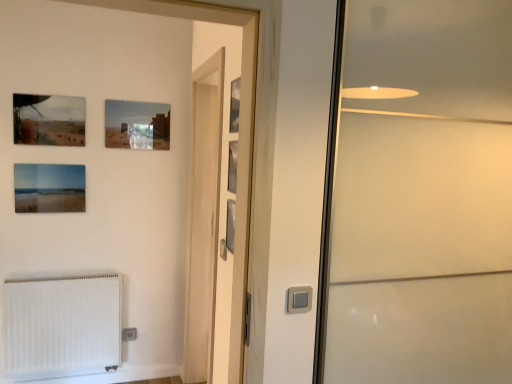
In order to face matte glass picture frame at upper center, which ranks as the first picture frame in back-to-front order, should I rotate leftwards or rightwards?

Turn left by 15.341 degrees to look at matte glass picture frame at upper center, which ranks as the first picture frame in back-to-front order.

What do you see at coordinates (49, 120) in the screenshot?
I see `matte glass picture frame at upper left, acting as the fourth picture frame starting from the front` at bounding box center [49, 120].

Describe the element at coordinates (234, 105) in the screenshot. I see `metallic silver picture frame at upper center, which is the 6th picture frame from back to front` at that location.

Find the location of a particular element. This screenshot has height=384, width=512. transparent glass screen door at right, the 2th screen door viewed from the left is located at coordinates (418, 195).

This screenshot has height=384, width=512. Describe the element at coordinates (203, 219) in the screenshot. I see `wooden screen door at center, marked as the 1th screen door in a left-to-right arrangement` at that location.

What is the approximate height of white matte radiator at lower left?

It is 25.38 inches.

You are a GUI agent. You are given a task and a screenshot of the screen. Output one action in this format:
    pyautogui.click(x=<x>, y=<y>)
    Task: Click on the matte glass picture frame at upper center, which ranks as the first picture frame in back-to-front order
    This screenshot has height=384, width=512.
    Given the screenshot: What is the action you would take?
    pyautogui.click(x=137, y=125)

Is matte glass picture frame at upper left, positioned as the 3th picture frame in back-to-front order, turned away from matte glass picture frame at upper center, which is the third picture frame in left-to-right order?

No, matte glass picture frame at upper left, positioned as the 3th picture frame in back-to-front order,'s orientation is not away from matte glass picture frame at upper center, which is the third picture frame in left-to-right order.

From the matte glass picture frame at upper left, positioned as the 3th picture frame in back-to-front order, count 1st picture frame to the right and point to it. Please provide its 2D coordinates.

[(137, 125)]

Between matte glass picture frame at upper left, positioned as the 3th picture frame in back-to-front order, and matte glass picture frame at upper center, which is the 4th picture frame in right-to-left order, which one is positioned in front?

Positioned in front is matte glass picture frame at upper left, positioned as the 3th picture frame in back-to-front order.

Is white plastic electric outlet at lower left further to the viewer compared to metallic silver picture frame at upper center, acting as the first picture frame starting from the front?

Yes, it is behind metallic silver picture frame at upper center, acting as the first picture frame starting from the front.

Based on the photo, does white plastic electric outlet at lower left have a larger size compared to metallic silver picture frame at upper center, which is the 1th picture frame from right to left?

No, white plastic electric outlet at lower left is not bigger than metallic silver picture frame at upper center, which is the 1th picture frame from right to left.

Looking at this image, considering the relative positions of white plastic electric outlet at lower left and metallic silver picture frame at upper center, acting as the first picture frame starting from the front, in the image provided, is white plastic electric outlet at lower left to the right of metallic silver picture frame at upper center, acting as the first picture frame starting from the front, from the viewer's perspective?

No.

Is point (123, 330) behind point (232, 97)?

Yes.

Could you measure the distance between white plastic electric outlet at lower left and wooden screen door at center, the 2th screen door viewed from the right?

white plastic electric outlet at lower left is 1.01 meters away from wooden screen door at center, the 2th screen door viewed from the right.

Would you consider white plastic electric outlet at lower left to be distant from wooden screen door at center, the 2th screen door viewed from the right?

Yes, white plastic electric outlet at lower left and wooden screen door at center, the 2th screen door viewed from the right, are located far from each other.

Can you confirm if white plastic electric outlet at lower left is smaller than wooden screen door at center, the 2th screen door viewed from the right?

Yes, white plastic electric outlet at lower left is smaller than wooden screen door at center, the 2th screen door viewed from the right.

Can we say white plastic electric outlet at lower left lies outside wooden screen door at center, marked as the 1th screen door in a left-to-right arrangement?

white plastic electric outlet at lower left lies outside wooden screen door at center, marked as the 1th screen door in a left-to-right arrangement,'s area.

Between metallic silver picture frame at center, which appears as the third picture frame when viewed from the right, and metallic silver picture frame at upper center, which is counted as the 5th picture frame, starting from the left, which one has more height?

Standing taller between the two is metallic silver picture frame at upper center, which is counted as the 5th picture frame, starting from the left.

Is metallic silver picture frame at center, which appears as the third picture frame when viewed from the front, completely or partially outside of metallic silver picture frame at upper center, the fifth picture frame from the back?

Yes, metallic silver picture frame at center, which appears as the third picture frame when viewed from the front, is not within metallic silver picture frame at upper center, the fifth picture frame from the back.

Consider the image. From a real-world perspective, is metallic silver picture frame at center, which appears as the third picture frame when viewed from the right, on top of metallic silver picture frame at upper center, which is counted as the 5th picture frame, starting from the left?

No.

From a real-world perspective, is white plastic electric outlet at lower left positioned above or below metallic silver picture frame at upper center, which is counted as the 5th picture frame, starting from the left?

From a real-world perspective, white plastic electric outlet at lower left is physically below metallic silver picture frame at upper center, which is counted as the 5th picture frame, starting from the left.

Based on the photo, is white plastic electric outlet at lower left oriented towards metallic silver picture frame at upper center, the fifth picture frame from the back?

No, white plastic electric outlet at lower left is not facing towards metallic silver picture frame at upper center, the fifth picture frame from the back.

Which object is thinner, white plastic electric outlet at lower left or metallic silver picture frame at upper center, which is counted as the 5th picture frame, starting from the left?

With smaller width is metallic silver picture frame at upper center, which is counted as the 5th picture frame, starting from the left.

Considering the relative sizes of white plastic electric outlet at lower left and metallic silver picture frame at upper center, positioned as the 2th picture frame in right-to-left order, in the image provided, is white plastic electric outlet at lower left bigger than metallic silver picture frame at upper center, positioned as the 2th picture frame in right-to-left order,?

No, white plastic electric outlet at lower left is not bigger than metallic silver picture frame at upper center, positioned as the 2th picture frame in right-to-left order.

In the scene shown: From the image's perspective, which object appears higher, white plastic electric outlet at lower left or matte glass picture frame at upper center, the sixth picture frame from the front?

matte glass picture frame at upper center, the sixth picture frame from the front, appears higher in the image.

In the scene shown: Considering the relative sizes of white plastic electric outlet at lower left and matte glass picture frame at upper center, which is the third picture frame in left-to-right order, in the image provided, is white plastic electric outlet at lower left bigger than matte glass picture frame at upper center, which is the third picture frame in left-to-right order,?

Incorrect, white plastic electric outlet at lower left is not larger than matte glass picture frame at upper center, which is the third picture frame in left-to-right order.

Is white plastic electric outlet at lower left at the left side of matte glass picture frame at upper center, which is the third picture frame in left-to-right order?

Yes.

Would you consider white plastic electric outlet at lower left to be distant from matte glass picture frame at upper center, the sixth picture frame from the front?

white plastic electric outlet at lower left is far away from matte glass picture frame at upper center, the sixth picture frame from the front.

Looking at this image, which of these two, metallic silver picture frame at upper center, the 2th picture frame positioned from the front, or metallic silver picture frame at center, which appears as the third picture frame when viewed from the front, stands shorter?

Standing shorter between the two is metallic silver picture frame at center, which appears as the third picture frame when viewed from the front.

Considering the sizes of objects metallic silver picture frame at upper center, the fifth picture frame from the back, and metallic silver picture frame at center, acting as the fourth picture frame starting from the left, in the image provided, who is bigger, metallic silver picture frame at upper center, the fifth picture frame from the back, or metallic silver picture frame at center, acting as the fourth picture frame starting from the left,?

With larger size is metallic silver picture frame at upper center, the fifth picture frame from the back.

Is metallic silver picture frame at upper center, the 2th picture frame positioned from the front, inside or outside of metallic silver picture frame at center, acting as the 4th picture frame starting from the back?

metallic silver picture frame at upper center, the 2th picture frame positioned from the front, is outside metallic silver picture frame at center, acting as the 4th picture frame starting from the back.

Is metallic silver picture frame at upper center, the 2th picture frame positioned from the front, in front of metallic silver picture frame at center, acting as the fourth picture frame starting from the left?

Yes, the depth of metallic silver picture frame at upper center, the 2th picture frame positioned from the front, is less than that of metallic silver picture frame at center, acting as the fourth picture frame starting from the left.

You are a GUI agent. You are given a task and a screenshot of the screen. Output one action in this format:
    pyautogui.click(x=<x>, y=<y>)
    Task: Click on the 1st picture frame to the left when counting from the matte glass picture frame at upper center, which ranks as the first picture frame in back-to-front order
    The image size is (512, 384).
    Given the screenshot: What is the action you would take?
    pyautogui.click(x=49, y=120)

Which picture frame is the 6th one when counting from the front of the white plastic electric outlet at lower left? Please provide its 2D coordinates.

[(234, 105)]

In the scene shown: From the image, which object appears to be farther from metallic silver picture frame at upper center, which is the 1th picture frame from right to left, matte glass picture frame at upper center, which is the 4th picture frame in right-to-left order, or transparent glass screen door at right, which appears as the first screen door when viewed from the right?

The object further to metallic silver picture frame at upper center, which is the 1th picture frame from right to left, is matte glass picture frame at upper center, which is the 4th picture frame in right-to-left order.

When comparing their distances from white matte radiator at lower left, does matte glass picture frame at upper center, the sixth picture frame from the front, or wooden screen door at center, marked as the 1th screen door in a left-to-right arrangement, seem closer?

wooden screen door at center, marked as the 1th screen door in a left-to-right arrangement.

Which object lies further to the anchor point matte glass picture frame at upper left, acting as the fourth picture frame starting from the front, white matte radiator at lower left or transparent glass screen door at right, which appears as the first screen door when viewed from the right?

Among the two, transparent glass screen door at right, which appears as the first screen door when viewed from the right, is located further to matte glass picture frame at upper left, acting as the fourth picture frame starting from the front.

When comparing their distances from matte glass picture frame at upper left, which ranks as the 5th picture frame in right-to-left order, does metallic silver picture frame at upper center, the 6th picture frame when ordered from left to right, or matte glass picture frame at upper center, which is the third picture frame in left-to-right order, seem further?

metallic silver picture frame at upper center, the 6th picture frame when ordered from left to right, lies further to matte glass picture frame at upper left, which ranks as the 5th picture frame in right-to-left order, than the other object.

When comparing their distances from wooden screen door at center, the 2th screen door viewed from the right, does metallic silver picture frame at upper center, positioned as the 2th picture frame in right-to-left order, or matte glass picture frame at lower left, which appears as the sixth picture frame when viewed from the right, seem closer?

metallic silver picture frame at upper center, positioned as the 2th picture frame in right-to-left order, is closer to wooden screen door at center, the 2th screen door viewed from the right.

Looking at the image, which one is located closer to wooden screen door at center, marked as the 1th screen door in a left-to-right arrangement, metallic silver picture frame at upper center, which is the 1th picture frame from right to left, or white matte radiator at lower left?

Among the two, white matte radiator at lower left is located nearer to wooden screen door at center, marked as the 1th screen door in a left-to-right arrangement.

Based on their spatial positions, is metallic silver picture frame at upper center, the 6th picture frame when ordered from left to right, or white matte radiator at lower left closer to metallic silver picture frame at upper center, the fifth picture frame from the back?

metallic silver picture frame at upper center, the 6th picture frame when ordered from left to right.

When comparing their distances from wooden screen door at center, marked as the 1th screen door in a left-to-right arrangement, does metallic silver picture frame at upper center, which is counted as the 5th picture frame, starting from the left, or metallic silver picture frame at upper center, which is the 6th picture frame from back to front, seem closer?

metallic silver picture frame at upper center, which is counted as the 5th picture frame, starting from the left.

Find the location of a particular element. picture frame situated between metallic silver picture frame at upper center, positioned as the 2th picture frame in right-to-left order, and transparent glass screen door at right, which appears as the first screen door when viewed from the right, from left to right is located at coordinates (234, 105).

Locate an element on the screen. This screenshot has width=512, height=384. electric outlet between matte glass picture frame at lower left, placed as the fifth picture frame when sorted from front to back, and metallic silver picture frame at center, acting as the fourth picture frame starting from the left, in the horizontal direction is located at coordinates (129, 334).

Find the location of a particular element. The height and width of the screenshot is (384, 512). electric outlet between matte glass picture frame at lower left, the 1th picture frame positioned from the left, and metallic silver picture frame at upper center, the 2th picture frame positioned from the front, in the horizontal direction is located at coordinates (129, 334).

At what (x,y) coordinates should I click in order to perform the action: click on screen door between matte glass picture frame at upper center, which is the third picture frame in left-to-right order, and transparent glass screen door at right, the 2th screen door viewed from the left, in the horizontal direction. Please return your answer as a coordinate pair (x, y). Looking at the image, I should click on (203, 219).